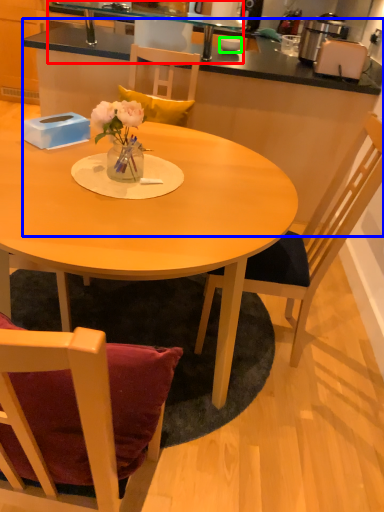
Question: Which object is positioned farthest from sink (highlighted by a red box)? Select from table (highlighted by a blue box) and coffee cup (highlighted by a green box).

Choices:
 (A) table
 (B) coffee cup

Answer: (A)